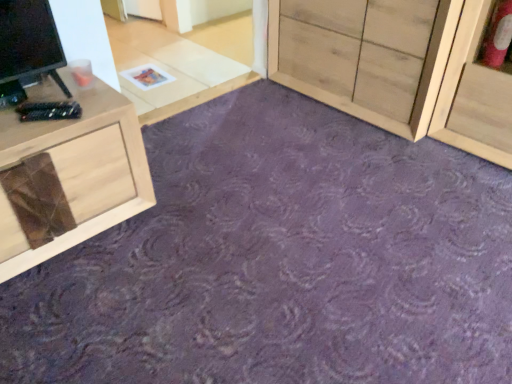
Measure the distance between point (10, 214) and camera.

1.23 meters.

Locate an element on the screen. This screenshot has width=512, height=384. wooden chest of drawers at left is located at coordinates (78, 171).

What do you see at coordinates (78, 171) in the screenshot? I see `wooden chest of drawers at left` at bounding box center [78, 171].

The image size is (512, 384). I want to click on wooden chest of drawers at left, so click(x=78, y=171).